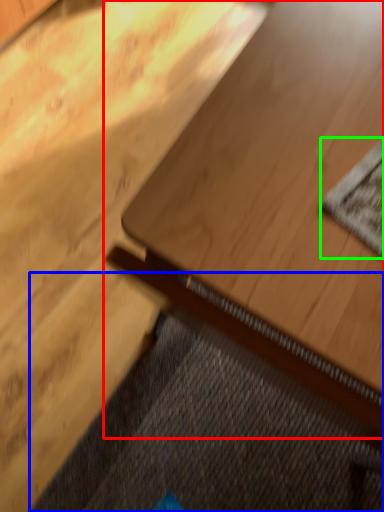
Question: Which is farther away from table (highlighted by a red box)? doormat (highlighted by a blue box) or mat (highlighted by a green box)?

Choices:
 (A) doormat
 (B) mat

Answer: (A)